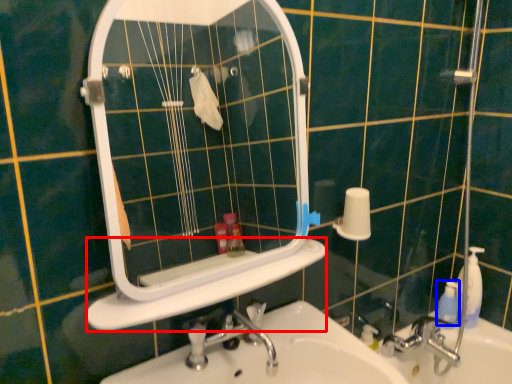
Question: Which object is closer to the camera taking this photo, ledge (highlighted by a red box) or mouthwash (highlighted by a blue box)?

Choices:
 (A) ledge
 (B) mouthwash

Answer: (A)